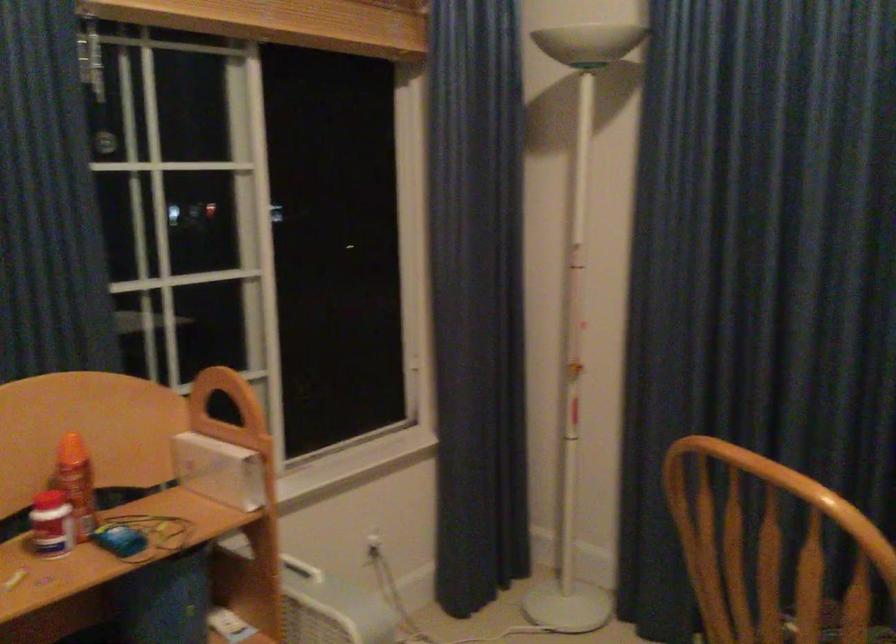
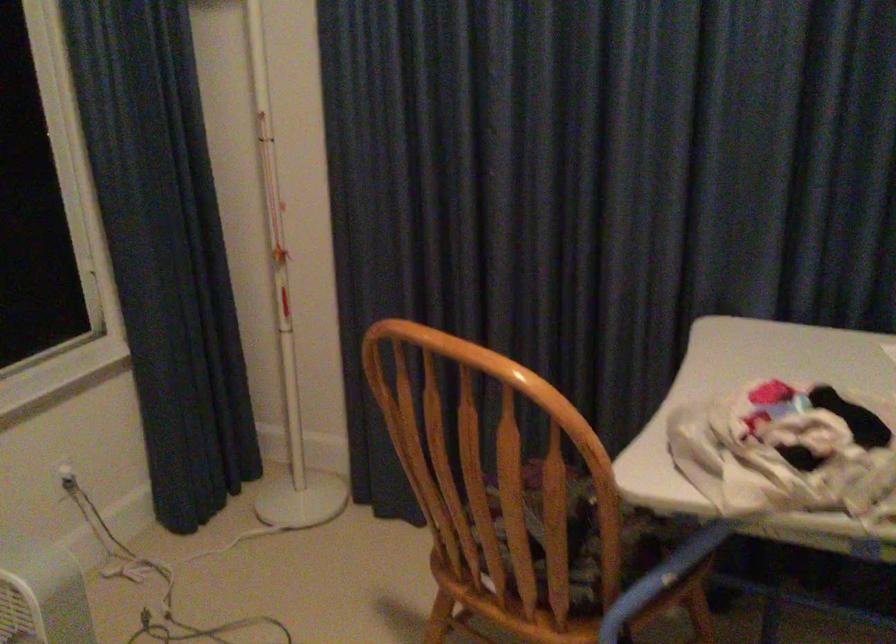
The images are taken continuously from a first-person perspective. In which direction are you moving?

The cameraman moved toward right, forward.